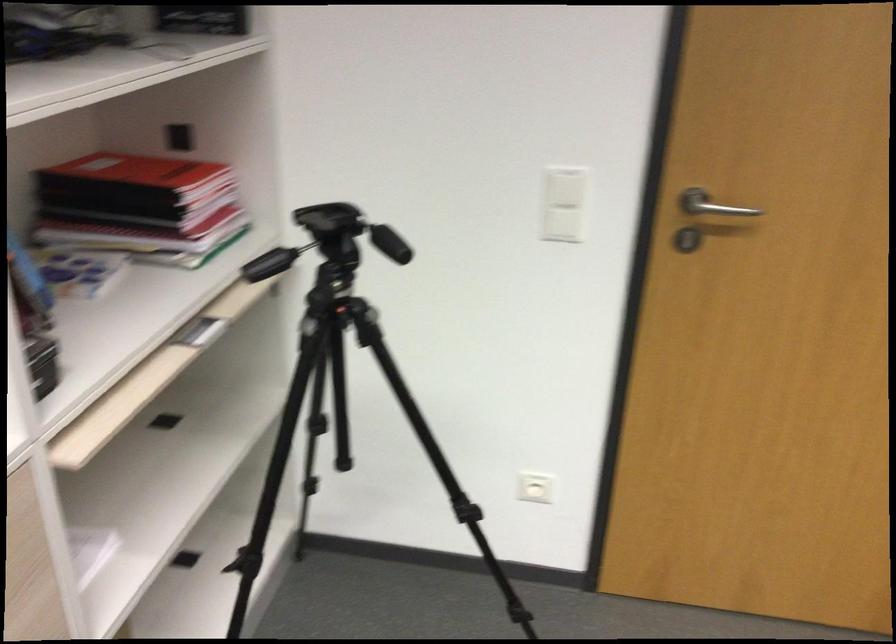
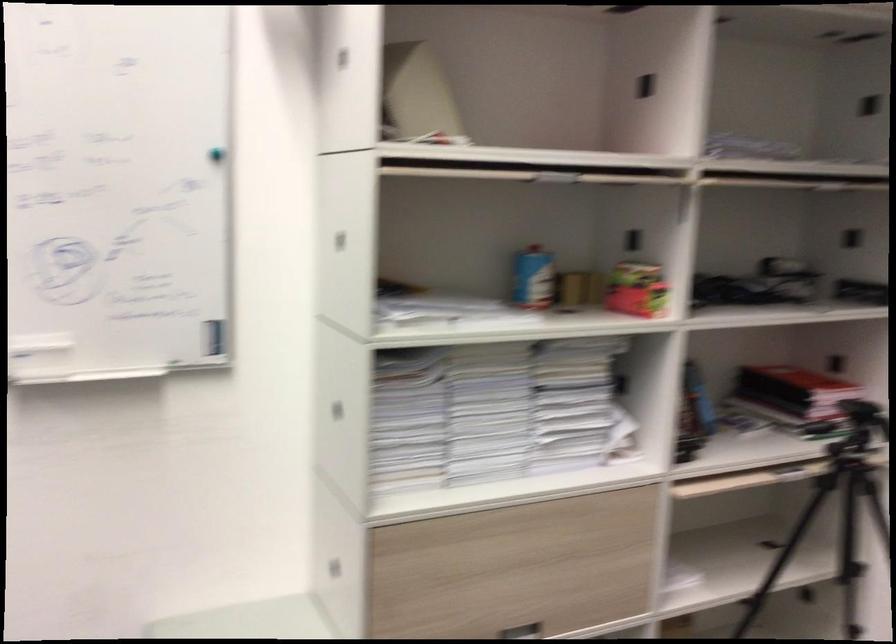
Locate, in the second image, the point that corresponds to point (92, 564) in the first image.

(678, 581)